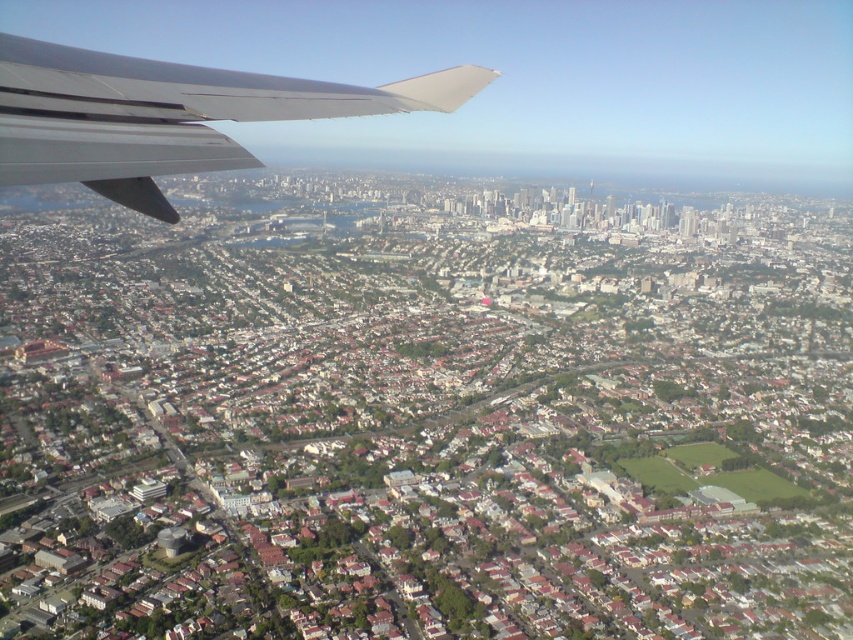
Looking at this image, which is more to the right, metallic gray wing at upper left or matte gray wing at upper left?

metallic gray wing at upper left is more to the right.

Who is more forward, [100,177] or [367,92]?

Positioned in front is point [100,177].

Is point (376, 109) positioned in front of point (238, 76)?

That is True.

Identify the location of metallic gray wing at upper left. (167, 115).